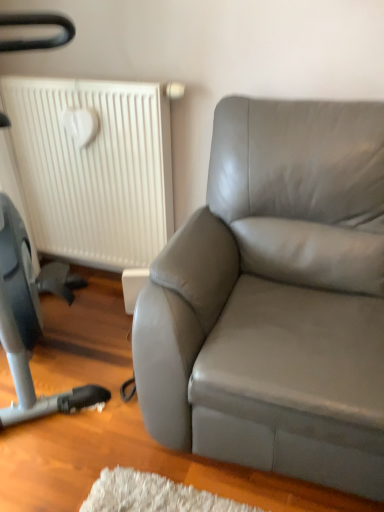
Question: From the image's perspective, is white matte radiator at upper left over satin gray leather couch at right?

Choices:
 (A) yes
 (B) no

Answer: (A)

Question: Can you confirm if white matte radiator at upper left is shorter than satin gray leather couch at right?

Choices:
 (A) no
 (B) yes

Answer: (B)

Question: Is white matte radiator at upper left smaller than satin gray leather couch at right?

Choices:
 (A) no
 (B) yes

Answer: (B)

Question: Is white matte radiator at upper left not close to satin gray leather couch at right?

Choices:
 (A) yes
 (B) no

Answer: (B)

Question: Is white matte radiator at upper left outside of satin gray leather couch at right?

Choices:
 (A) yes
 (B) no

Answer: (A)

Question: Does white matte radiator at upper left contain satin gray leather couch at right?

Choices:
 (A) no
 (B) yes

Answer: (A)

Question: Does satin gray leather couch at right have a greater width compared to white matte radiator at upper left?

Choices:
 (A) yes
 (B) no

Answer: (A)

Question: Is white matte radiator at upper left at the back of satin gray leather couch at right?

Choices:
 (A) yes
 (B) no

Answer: (B)

Question: Does satin gray leather couch at right have a lesser width compared to white matte radiator at upper left?

Choices:
 (A) no
 (B) yes

Answer: (A)

Question: Is satin gray leather couch at right at the left side of white matte radiator at upper left?

Choices:
 (A) yes
 (B) no

Answer: (B)

Question: Does satin gray leather couch at right have a smaller size compared to white matte radiator at upper left?

Choices:
 (A) no
 (B) yes

Answer: (A)

Question: Can you confirm if satin gray leather couch at right is bigger than white matte radiator at upper left?

Choices:
 (A) yes
 (B) no

Answer: (A)

Question: From the image's perspective, is white matte radiator at upper left located above or below satin gray leather couch at right?

Choices:
 (A) below
 (B) above

Answer: (B)